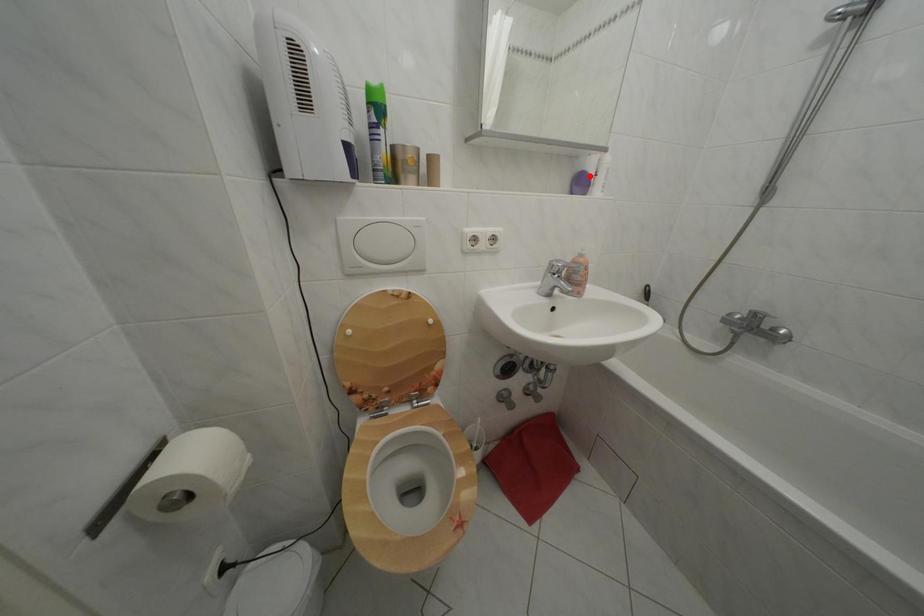
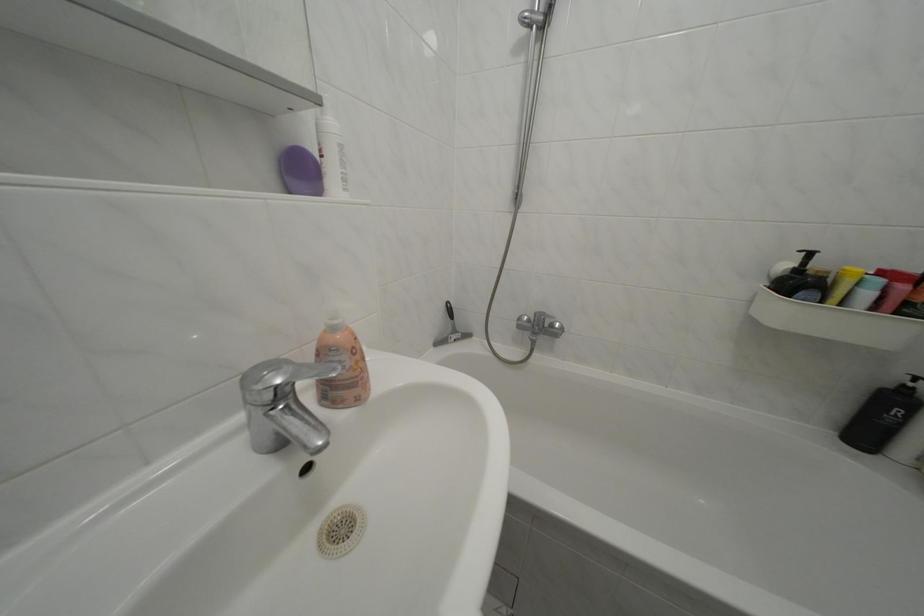
Find the pixel in the second image that matches the highlighted location in the first image.

(301, 150)